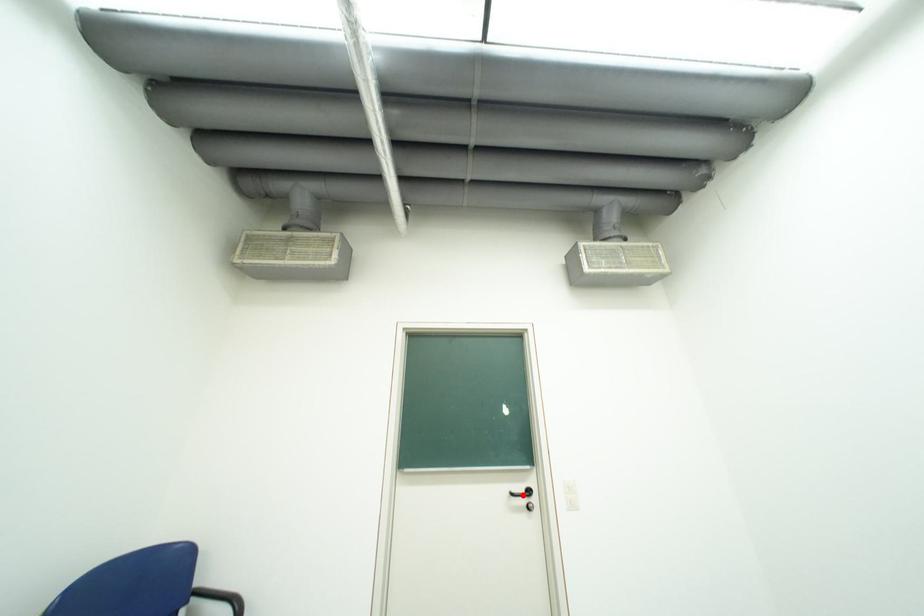
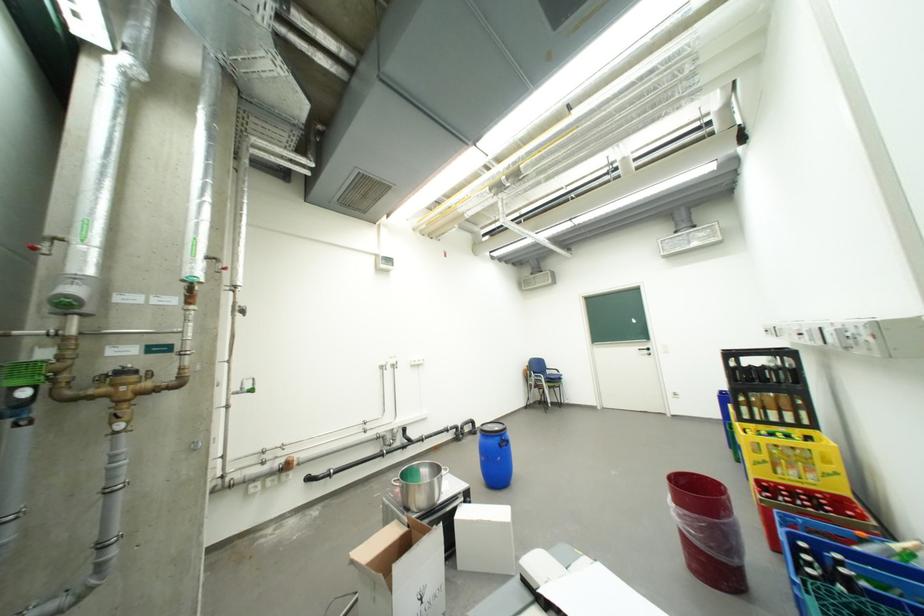
In the second image, find the point that corresponds to the highlighted location in the first image.

(650, 351)